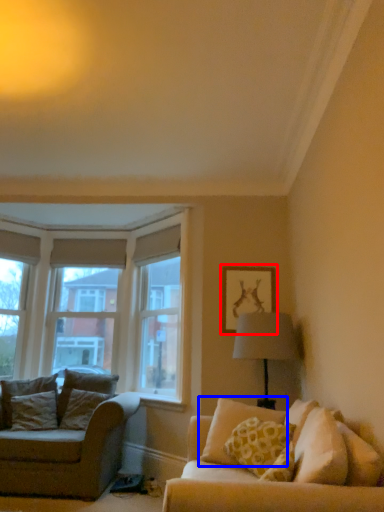
Question: Among these objects, which one is nearest to the camera, picture frame (highlighted by a red box) or pillow (highlighted by a blue box)?

Choices:
 (A) picture frame
 (B) pillow

Answer: (B)